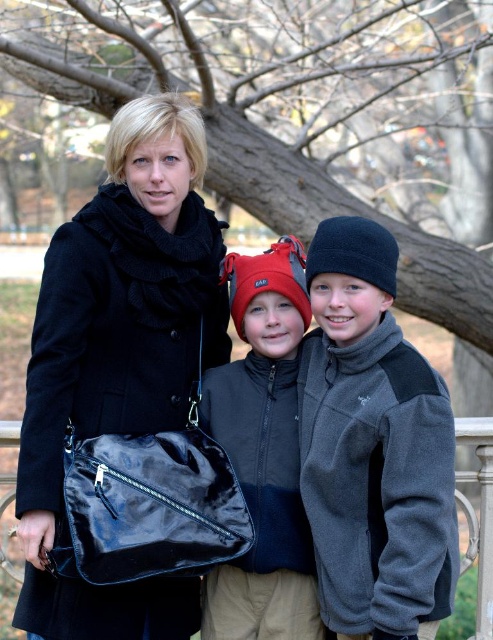
You are a photographer trying to capture a clear shot of the matte black jacket at center and the glossy black bag at lower center. Which object should you focus on first if you want to ensure both are in focus without adjusting the camera settings?

The matte black jacket at center is above the glossy black bag at lower center, so focusing on the matte black jacket at center first will ensure both are in focus since it is closer to the camera.

Based on the scene description, which object is smaller in size between the brown bark tree at center and the matte black jacket at center?

The brown bark tree at center is smaller in size compared to the matte black jacket at center according to the description.

Based on the scene description, which object is wider between the velvet black coat at center and the dark gray fleece jacket at center?

The velvet black coat at center is wider than the dark gray fleece jacket at center.